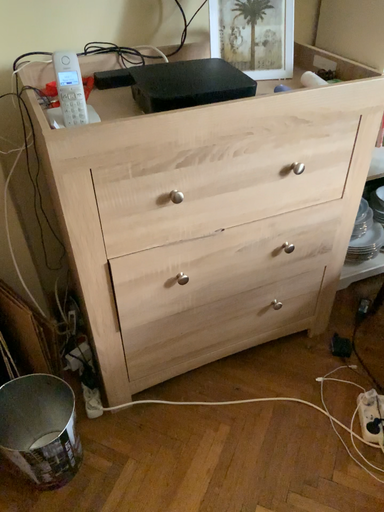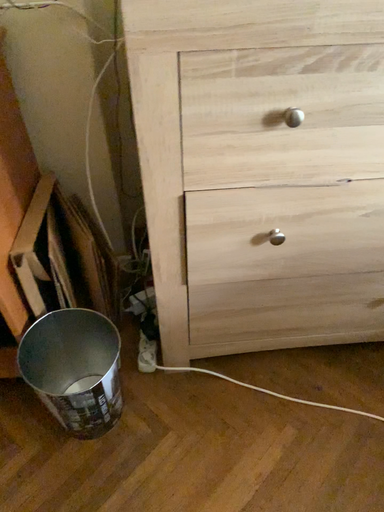
Question: How did the camera likely rotate when shooting the video?

Choices:
 (A) rotated left
 (B) rotated right

Answer: (A)